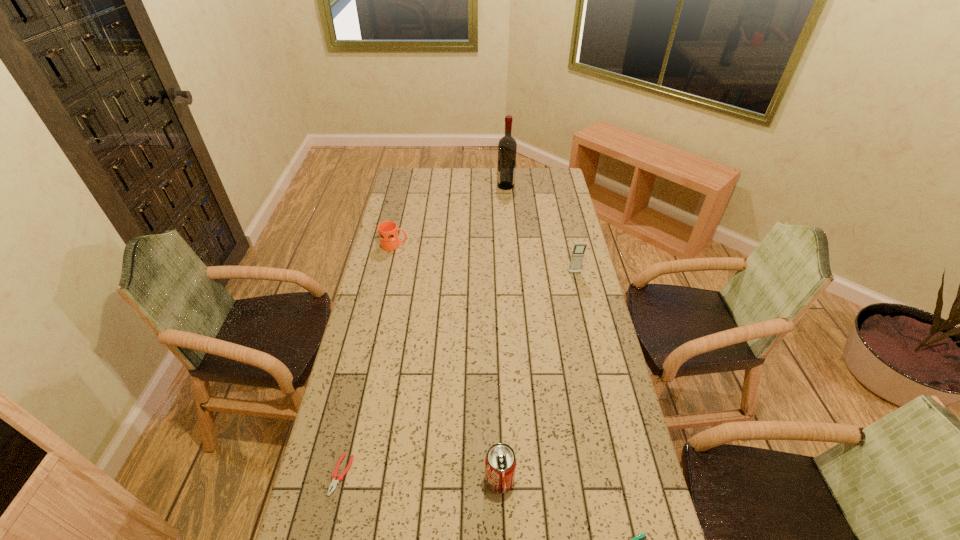
Where is `alcohol`? alcohol is located at coordinates (507, 147).

You are a GUI agent. You are given a task and a screenshot of the screen. Output one action in this format:
    pyautogui.click(x=<x>, y=<y>)
    Task: Click on the farthest object
    The image size is (960, 540).
    Given the screenshot: What is the action you would take?
    pyautogui.click(x=507, y=147)

Where is `cellular telephone`? Image resolution: width=960 pixels, height=540 pixels. cellular telephone is located at coordinates (577, 256).

This screenshot has height=540, width=960. What are the coordinates of `the fifth shortest object` in the screenshot? It's located at (577, 256).

Locate an element on the screen. the third tallest object is located at coordinates (500, 462).

Find the location of a particular element. the second farthest object is located at coordinates (388, 232).

Where is `the third shortest object`? Image resolution: width=960 pixels, height=540 pixels. the third shortest object is located at coordinates (388, 232).

Identify the location of the left pliers. This screenshot has height=540, width=960. (335, 476).

Image resolution: width=960 pixels, height=540 pixels. In order to click on vacant region located 0.180m on the front and back of the farthest object in this screenshot , I will do `click(464, 186)`.

You are a GUI agent. You are given a task and a screenshot of the screen. Output one action in this format:
    pyautogui.click(x=<x>, y=<y>)
    Task: Click on the free space located on the front and back of the farthest object
    This screenshot has height=540, width=960.
    Given the screenshot: What is the action you would take?
    pyautogui.click(x=476, y=186)